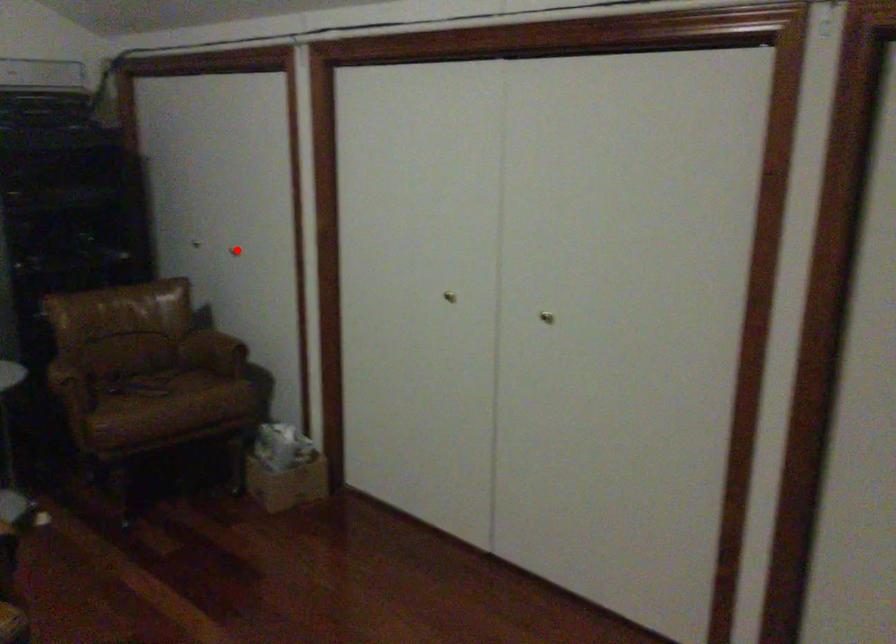
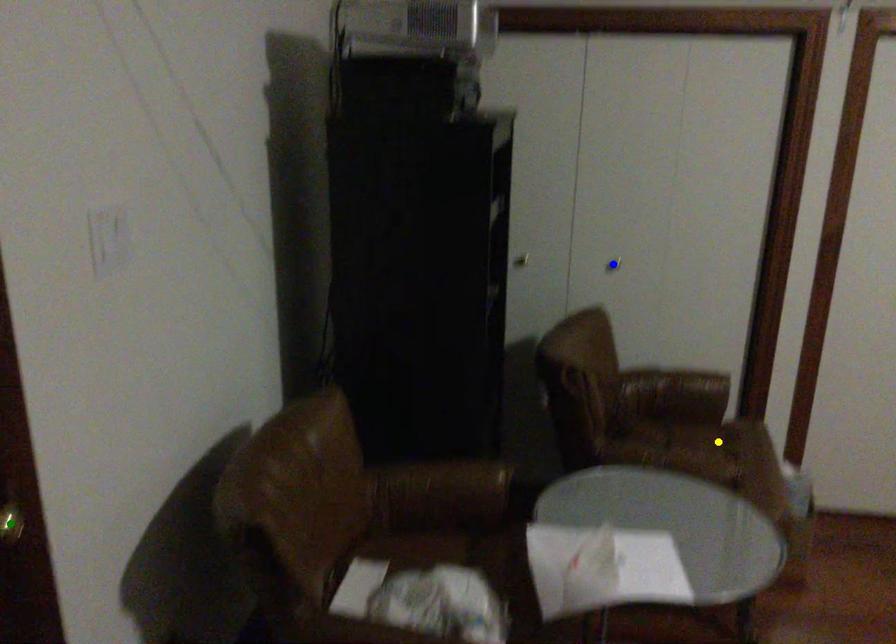
Question: I am providing you with two images of the same scene from different viewpoints. A red point is marked on the first image. You are given multiple points on the second image. Can you choose the point in image 2 that corresponds to the point in image 1?

Choices:
 (A) yellow point
 (B) green point
 (C) blue point

Answer: (C)